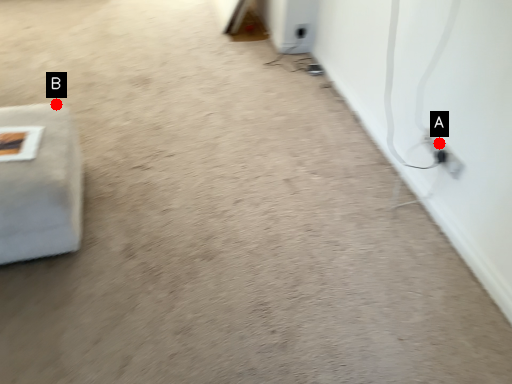
Question: Two points are circled on the image, labeled by A and B beside each circle. Which point is closer to the camera taking this photo?

Choices:
 (A) A is closer
 (B) B is closer

Answer: (A)